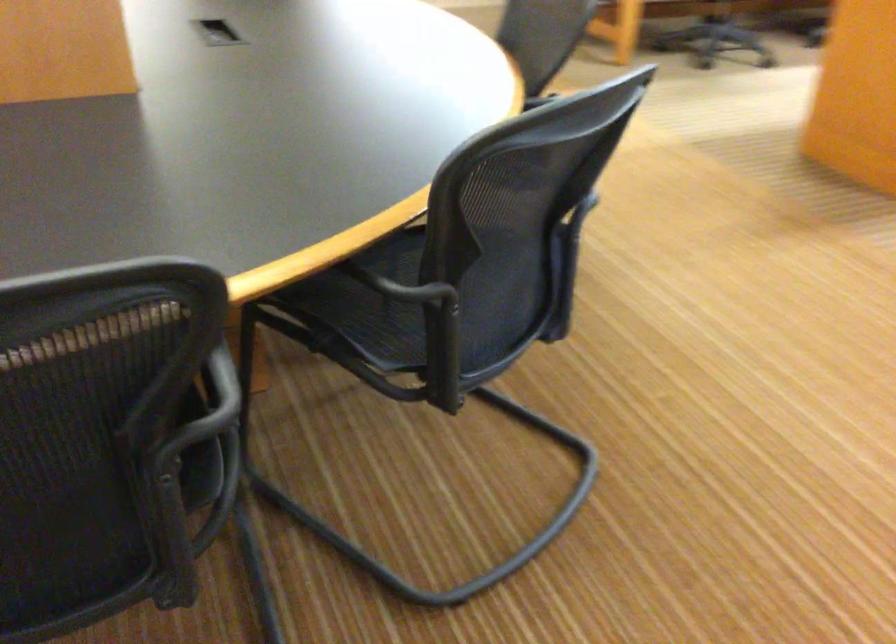
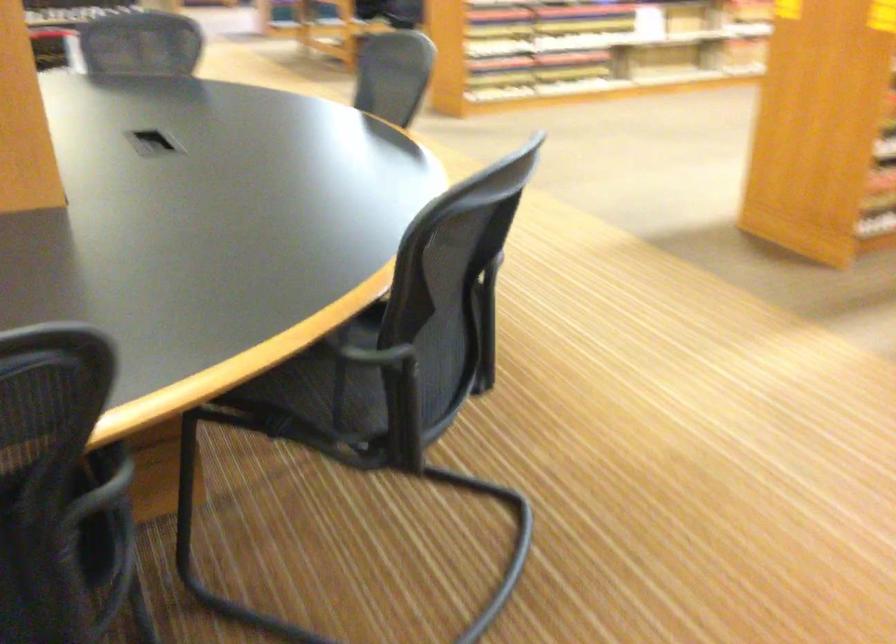
Question: How did the camera likely rotate?

Choices:
 (A) Left
 (B) Right
 (C) Up
 (D) Down

Answer: (B)